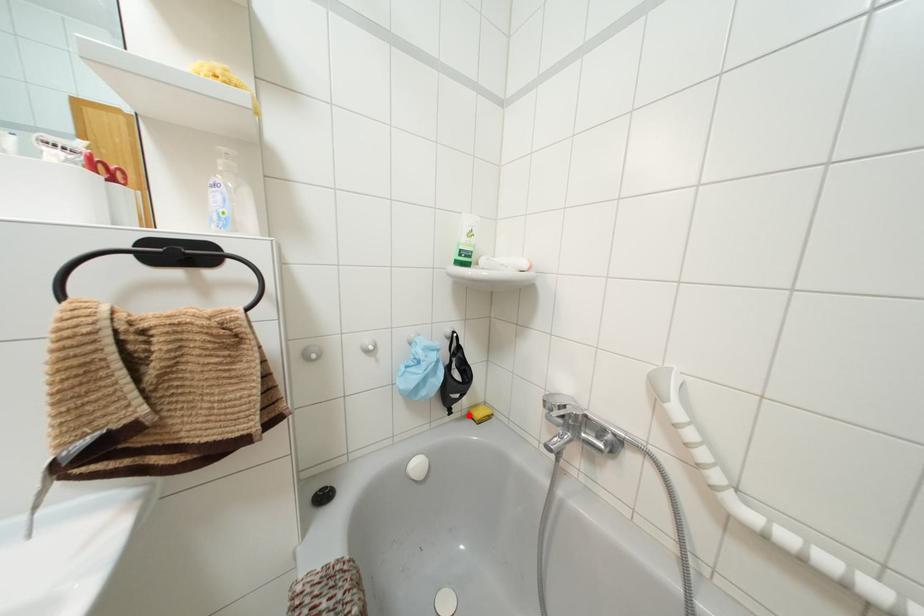
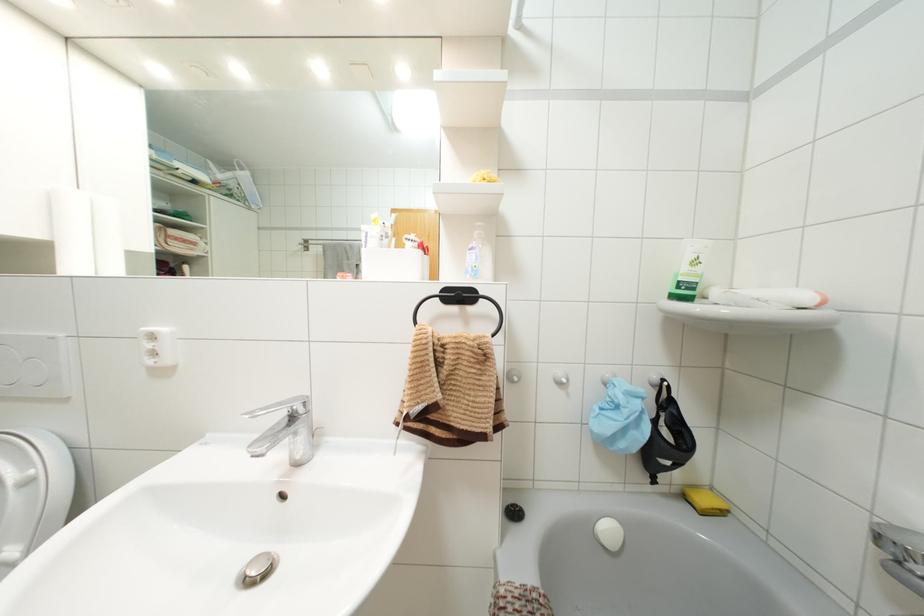
Question: I am providing you with two images of the same scene from different viewpoints. A red point is marked on the first image. Is the red point's position out of view in image 2?

Choices:
 (A) Yes
 (B) No

Answer: (B)